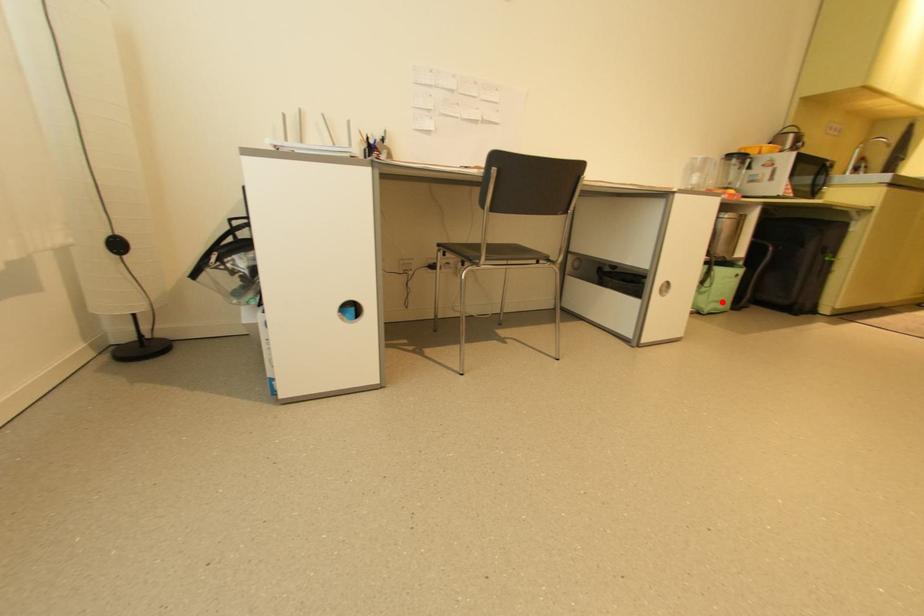
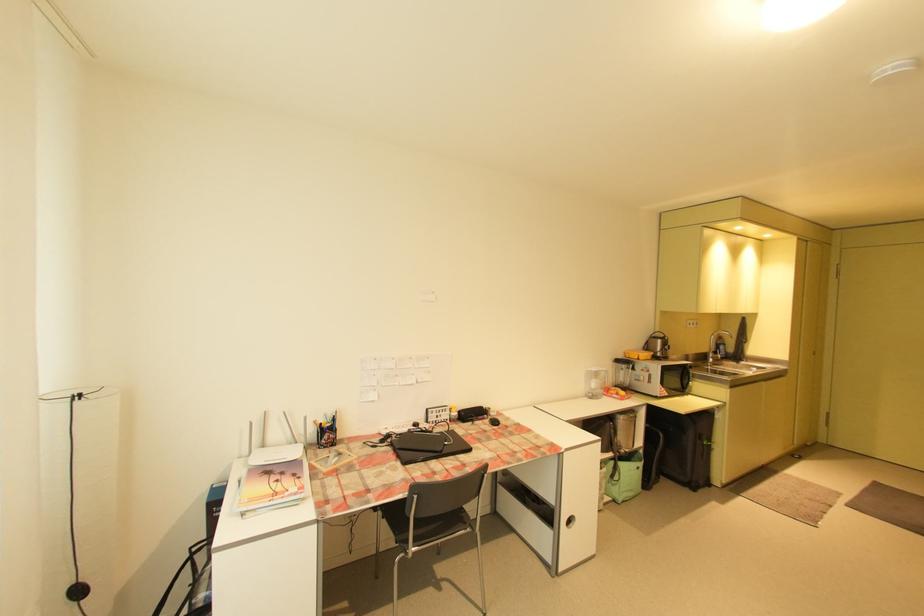
Question: I am providing you with two images of the same scene from different viewpoints. Image1 has a red point marked. In image2, the corresponding 3D location appears at what relative position? Reply with the corresponding letter.

Choices:
 (A) Closer
 (B) Farther

Answer: (B)